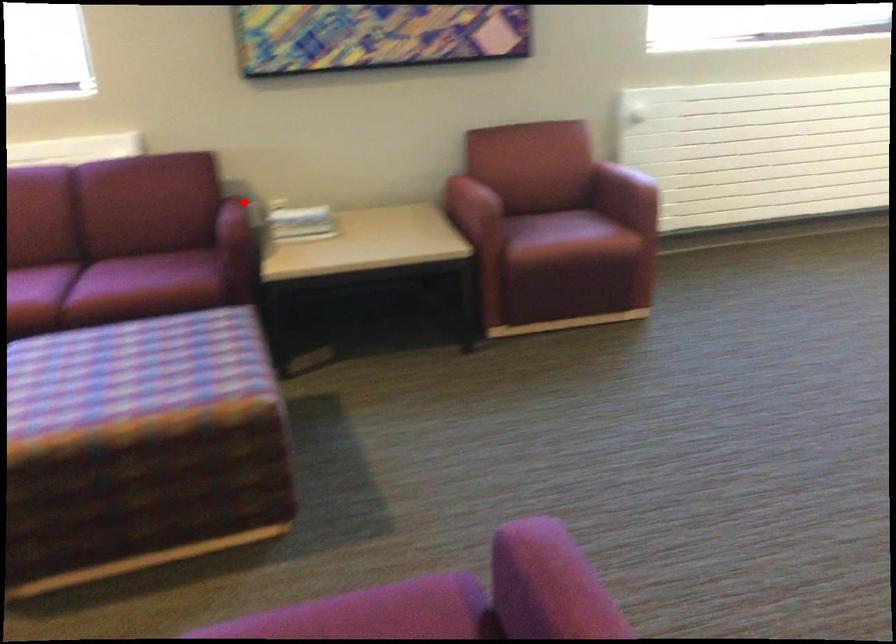
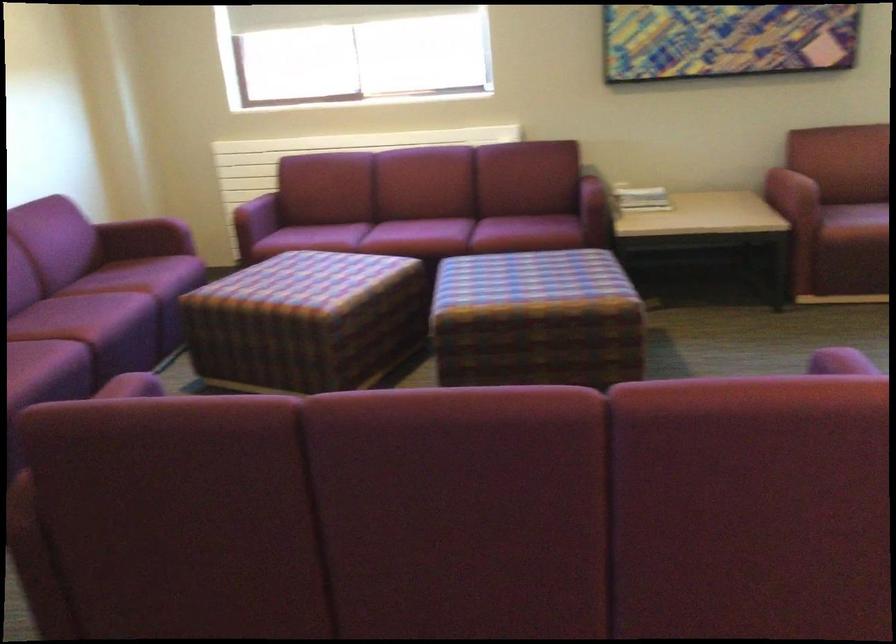
Locate, in the second image, the point that corresponds to the highlighted location in the first image.

(596, 178)